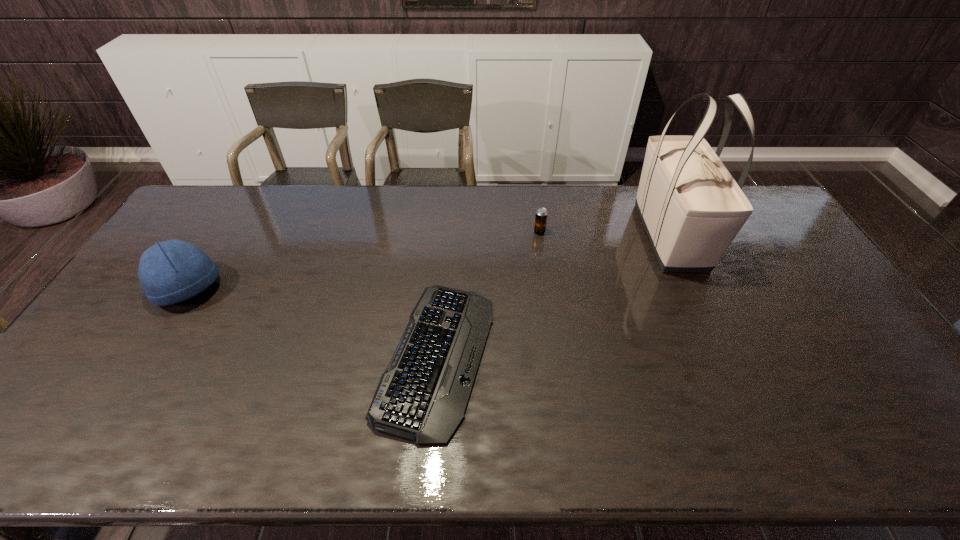
Locate an element on the screen. This screenshot has height=540, width=960. object that ranks as the third closest to the computer keyboard is located at coordinates (691, 207).

Locate which object is the closest to the rightmost object. Please provide its 2D coordinates. Your answer should be formatted as a tuple, i.e. [(x, y)], where the tuple contains the x and y coordinates of a point satisfying the conditions above.

[(541, 214)]

Locate an element on the screen. Image resolution: width=960 pixels, height=540 pixels. vacant space that satisfies the following two spatial constraints: 1. on the back side of the skullcap; 2. on the right side of the beer can is located at coordinates (224, 232).

Identify the location of blank area in the image that satisfies the following two spatial constraints: 1. on the back side of the third shortest object; 2. on the right side of the second shortest object. (224, 232).

Where is `vacant position in the image that satisfies the following two spatial constraints: 1. on the back side of the second tallest object; 2. on the left side of the third tallest object`? The width and height of the screenshot is (960, 540). vacant position in the image that satisfies the following two spatial constraints: 1. on the back side of the second tallest object; 2. on the left side of the third tallest object is located at coordinates (224, 232).

Where is `free location that satisfies the following two spatial constraints: 1. on the back side of the third object from left to right; 2. on the left side of the shortest object`? This screenshot has height=540, width=960. free location that satisfies the following two spatial constraints: 1. on the back side of the third object from left to right; 2. on the left side of the shortest object is located at coordinates (446, 232).